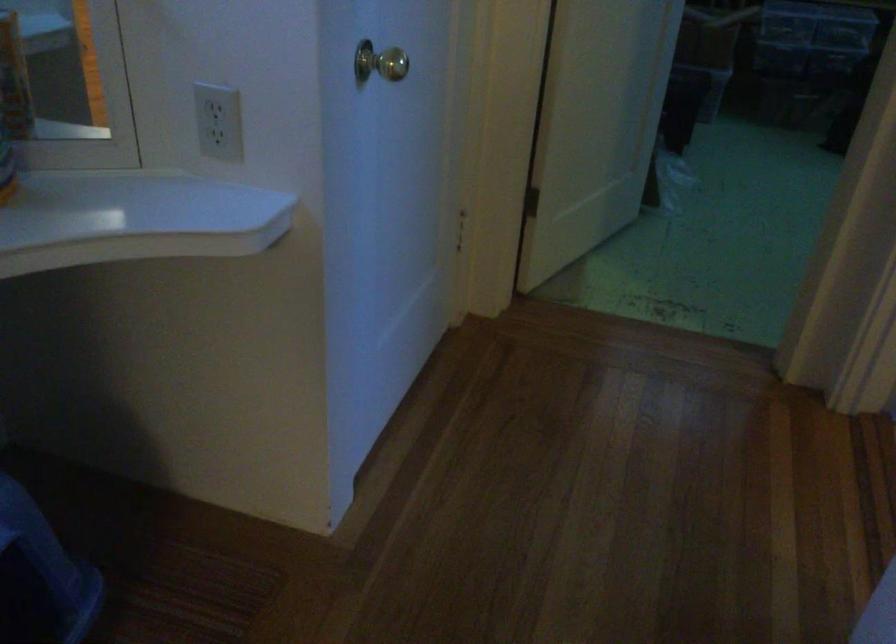
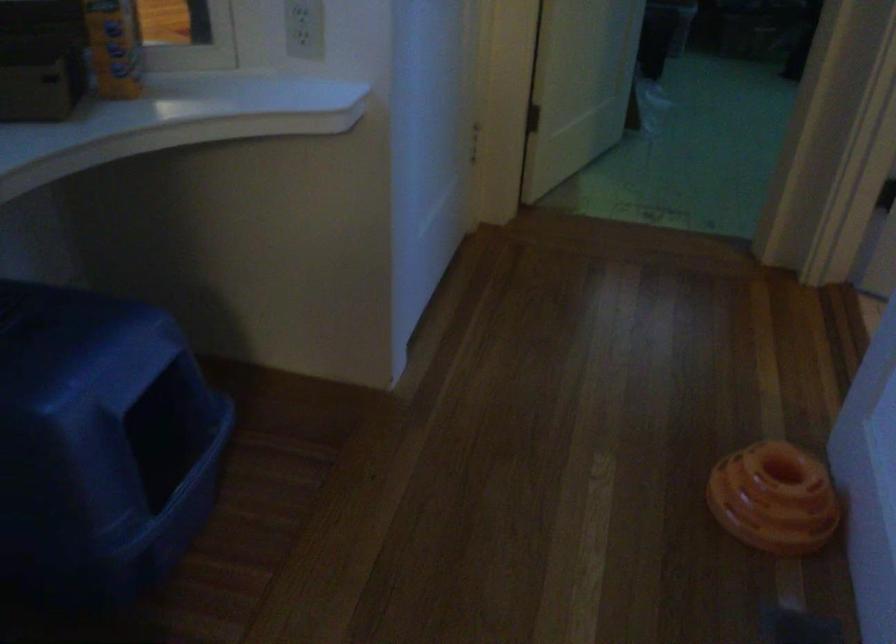
Question: The first image is from the beginning of the video and the second image is from the end. How did the camera likely rotate when shooting the video?

Choices:
 (A) Left
 (B) Right
 (C) Up
 (D) Down

Answer: (B)